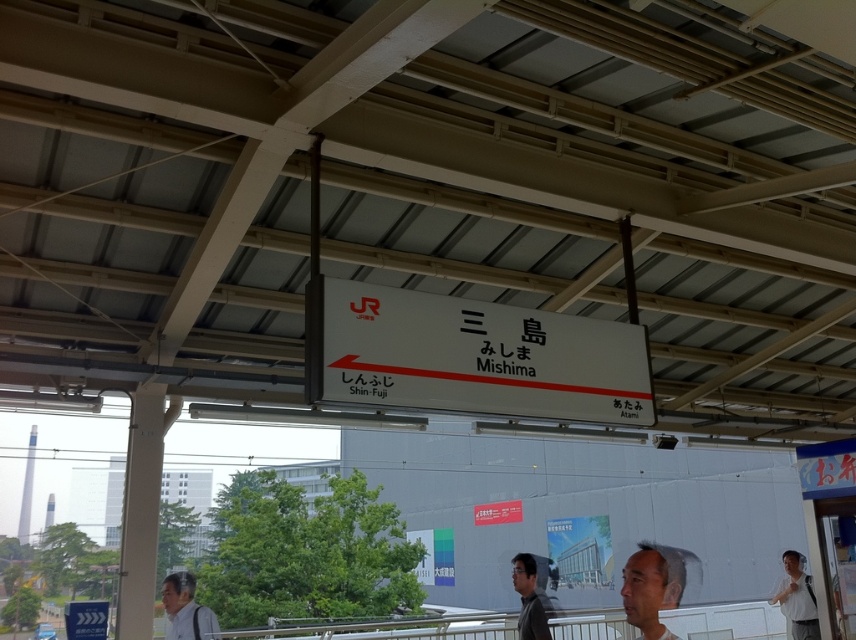
Is point (795, 628) positioned after point (544, 637)?

Yes, point (795, 628) is farther from viewer.

Who is more forward, (x=801, y=579) or (x=545, y=630)?

Positioned in front is point (x=545, y=630).

The image size is (856, 640). What do you see at coordinates (797, 598) in the screenshot? I see `white shirt at lower right` at bounding box center [797, 598].

Where is `white shirt at lower right`? The image size is (856, 640). white shirt at lower right is located at coordinates (797, 598).

Looking at this image, does smooth skin face at lower center have a lesser height compared to matte gray shirt at lower center?

Yes, smooth skin face at lower center is shorter than matte gray shirt at lower center.

Which is behind, point (664, 586) or point (544, 611)?

The point (544, 611) is behind.

Between point (639, 620) and point (536, 614), which one is positioned behind?

Point (536, 614)

Where is `smooth skin face at lower center`? The height and width of the screenshot is (640, 856). smooth skin face at lower center is located at coordinates (651, 588).

Does light gray shirt at lower left appear over white shirt at lower right?

Yes.

Which is more to the left, light gray shirt at lower left or white shirt at lower right?

From the viewer's perspective, light gray shirt at lower left appears more on the left side.

Who is more forward, [183,577] or [801,576]?

Point [183,577] is more forward.

I want to click on light gray shirt at lower left, so click(x=186, y=609).